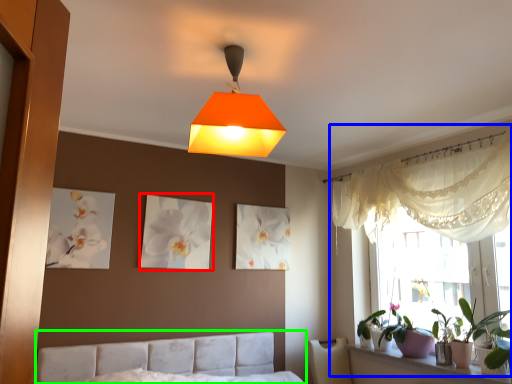
Question: Based on their relative distances, which object is nearer to picture frame (highlighted by a red box)? Choose from bay window (highlighted by a blue box) and bed (highlighted by a green box).

Choices:
 (A) bay window
 (B) bed

Answer: (B)